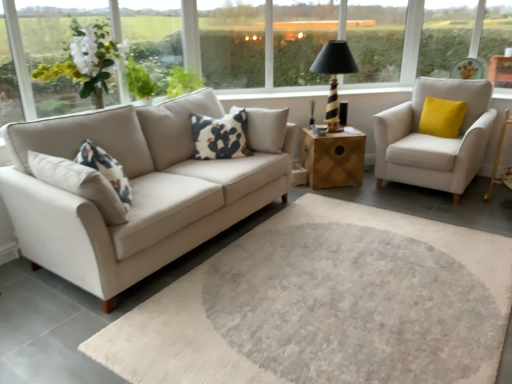
Question: Is the position of yellow velvet pillow at right, placed as the 1th pillow when sorted from right to left, more distant than that of white fabric armchair at right?

Choices:
 (A) yes
 (B) no

Answer: (A)

Question: Can you confirm if yellow velvet pillow at right, the second pillow viewed from the left, is positioned to the right of white fabric armchair at right?

Choices:
 (A) no
 (B) yes

Answer: (B)

Question: Considering the relative sizes of yellow velvet pillow at right, positioned as the 1th pillow in back-to-front order, and white fabric armchair at right in the image provided, is yellow velvet pillow at right, positioned as the 1th pillow in back-to-front order, bigger than white fabric armchair at right?

Choices:
 (A) yes
 (B) no

Answer: (B)

Question: Could you tell me if yellow velvet pillow at right, positioned as the 1th pillow in back-to-front order, is facing white fabric armchair at right?

Choices:
 (A) no
 (B) yes

Answer: (B)

Question: Is yellow velvet pillow at right, positioned as the 1th pillow in back-to-front order, closer to camera compared to white fabric armchair at right?

Choices:
 (A) yes
 (B) no

Answer: (B)

Question: Is white fabric armchair at right located within yellow velvet pillow at right, positioned as the 1th pillow in back-to-front order?

Choices:
 (A) yes
 (B) no

Answer: (B)

Question: Does yellow velvet pillow at right, the second pillow viewed from the front, have a larger size compared to wooden side table at center?

Choices:
 (A) no
 (B) yes

Answer: (A)

Question: Does yellow velvet pillow at right, the second pillow viewed from the front, contain wooden side table at center?

Choices:
 (A) no
 (B) yes

Answer: (A)

Question: Is yellow velvet pillow at right, placed as the 1th pillow when sorted from right to left, shorter than wooden side table at center?

Choices:
 (A) yes
 (B) no

Answer: (A)

Question: Is yellow velvet pillow at right, the second pillow viewed from the left, outside of wooden side table at center?

Choices:
 (A) yes
 (B) no

Answer: (A)

Question: Can you confirm if yellow velvet pillow at right, the second pillow viewed from the front, is thinner than wooden side table at center?

Choices:
 (A) no
 (B) yes

Answer: (B)

Question: Is the position of yellow velvet pillow at right, positioned as the 1th pillow in back-to-front order, more distant than that of wooden side table at center?

Choices:
 (A) yes
 (B) no

Answer: (B)

Question: Is black and white printed pillow at center, which ranks as the 1th pillow in left-to-right order, inside white matte flower at upper left?

Choices:
 (A) no
 (B) yes

Answer: (A)